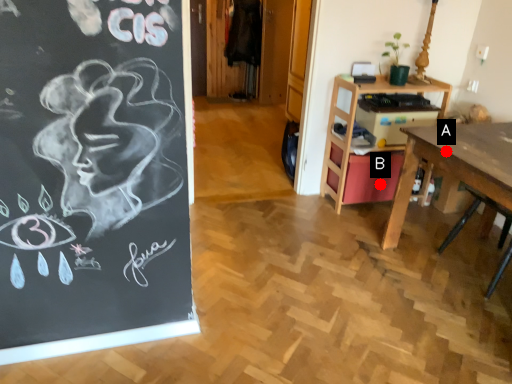
Question: Two points are circled on the image, labeled by A and B beside each circle. Among these points, which one is nearest to the camera?

Choices:
 (A) A is closer
 (B) B is closer

Answer: (A)